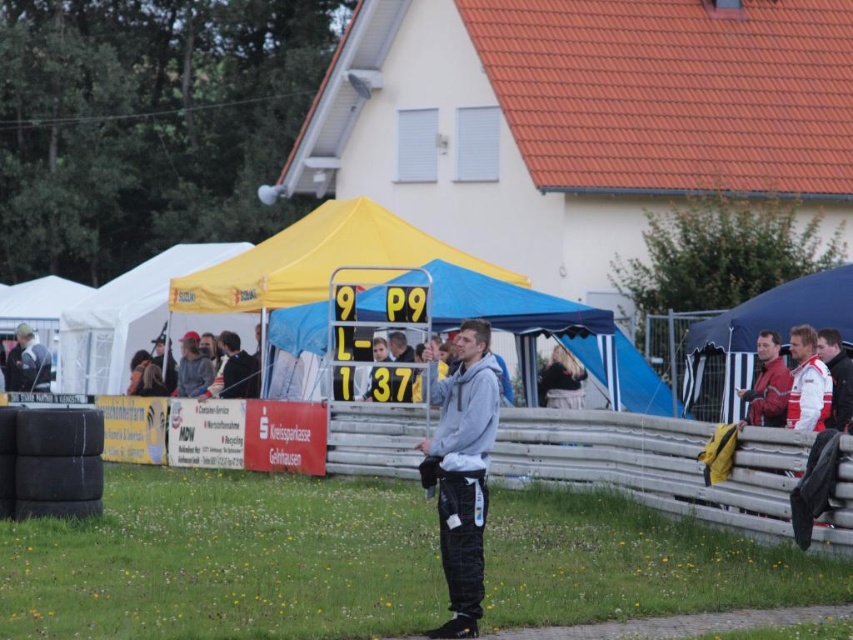
Question: From the image, what is the correct spatial relationship of yellow fabric canopy at upper left in relation to dark gray jacket at left?

Choices:
 (A) right
 (B) left

Answer: (A)

Question: Which point appears farthest from the camera in this image?

Choices:
 (A) (225, 324)
 (B) (723, 378)

Answer: (A)

Question: Is gray fleece jacket at center positioned before dark gray jacket at left?

Choices:
 (A) yes
 (B) no

Answer: (A)

Question: Which object appears farthest from the camera in this image?

Choices:
 (A) gray fleece jacket at center
 (B) red leather jacket at right
 (C) yellow fabric canopy at center
 (D) yellow fabric canopy at upper left

Answer: (D)

Question: Observing the image, what is the correct spatial positioning of gray fleece jacket at center in reference to dark gray jacket at left?

Choices:
 (A) above
 (B) below

Answer: (B)

Question: Which object is positioned closest to the gray fleece jacket at center?

Choices:
 (A) blue fabric canopy at right
 (B) yellow fabric canopy at center
 (C) yellow fabric canopy at upper left

Answer: (A)